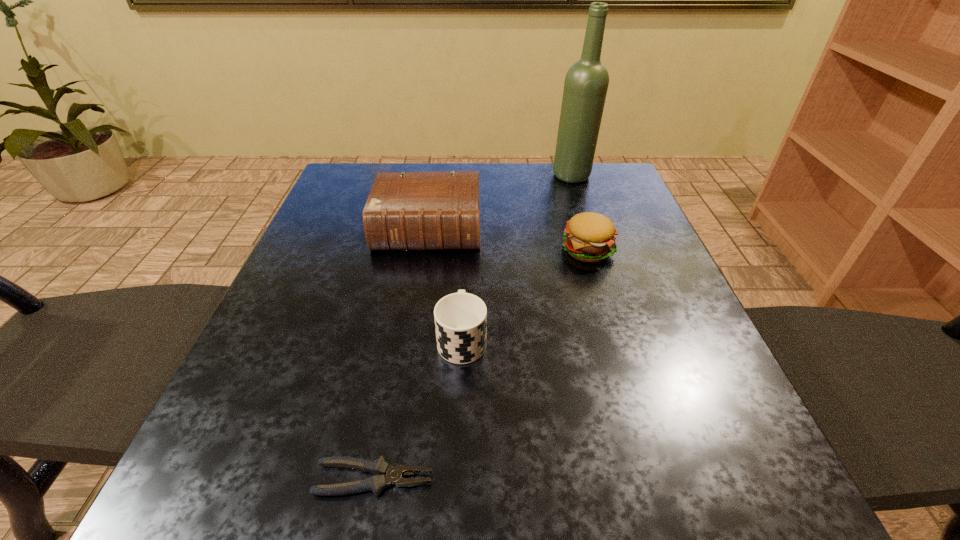
Image resolution: width=960 pixels, height=540 pixels. Find the location of `vacant space that's between the hamburger and the second nearest object`. vacant space that's between the hamburger and the second nearest object is located at coordinates (524, 294).

Find the location of `vacant region between the fourth shortest object and the second nearest object`. vacant region between the fourth shortest object and the second nearest object is located at coordinates (445, 285).

Identify the location of free space between the fourth farthest object and the hamburger. (524, 294).

The height and width of the screenshot is (540, 960). I want to click on blank region between the hamburger and the fourth shortest object, so click(508, 240).

Identify the location of vacant space that's between the pliers and the hamburger. The image size is (960, 540). (480, 364).

Where is `free space between the hamburger and the wine bottle`? This screenshot has height=540, width=960. free space between the hamburger and the wine bottle is located at coordinates (580, 213).

Identify which object is the nearest to the wine bottle. Please provide its 2D coordinates. Your answer should be formatted as a tuple, i.e. [(x, y)], where the tuple contains the x and y coordinates of a point satisfying the conditions above.

[(589, 237)]

Where is `object that is the closest to the hamburger`? The height and width of the screenshot is (540, 960). object that is the closest to the hamburger is located at coordinates (405, 211).

You are a GUI agent. You are given a task and a screenshot of the screen. Output one action in this format:
    pyautogui.click(x=<x>, y=<y>)
    Task: Click on the free location that satisfies the following two spatial constraints: 1. on the spine side of the Bible; 2. at the gripping part of the nearest object
    
    Given the screenshot: What is the action you would take?
    pyautogui.click(x=391, y=479)

Image resolution: width=960 pixels, height=540 pixels. In order to click on vacant position in the image that satisfies the following two spatial constraints: 1. on the side of the cup with the handle; 2. on the right side of the farthest object in this screenshot , I will do `click(468, 176)`.